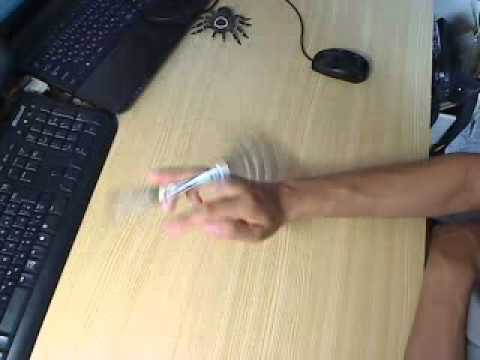
Find the location of a particular element. The width and height of the screenshot is (480, 360). computer mouse is located at coordinates (334, 64).